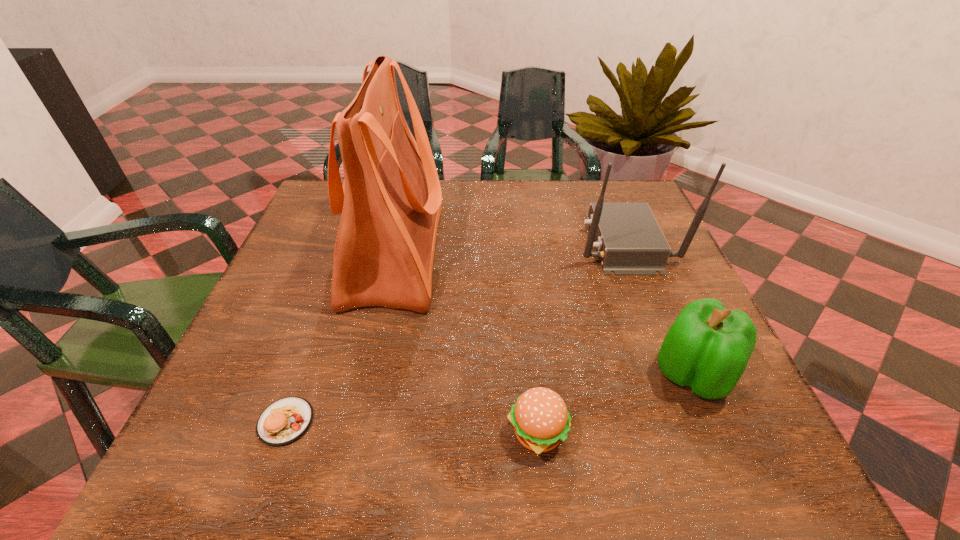
This screenshot has width=960, height=540. I want to click on free space located on the left of the bell pepper, so click(x=498, y=375).

Identify the location of vacant area situated on the right of the fourth tallest object. (734, 433).

Find the location of a particular element. This screenshot has height=540, width=960. vacant area located on the right of the shortest object is located at coordinates (524, 422).

I want to click on shopping bag located at the far edge, so click(x=390, y=201).

Locate an element on the screen. This screenshot has height=540, width=960. router situated at the far edge is located at coordinates (629, 241).

The width and height of the screenshot is (960, 540). What are the coordinates of `hamburger situated at the near edge` in the screenshot? It's located at (541, 420).

Identify the location of patty present at the near edge. (286, 420).

Image resolution: width=960 pixels, height=540 pixels. Find the location of `shopping bag present at the left edge`. shopping bag present at the left edge is located at coordinates (390, 201).

Locate an element on the screen. The width and height of the screenshot is (960, 540). patty that is positioned at the left edge is located at coordinates (286, 420).

In order to click on router situated at the right edge in this screenshot , I will do `click(629, 241)`.